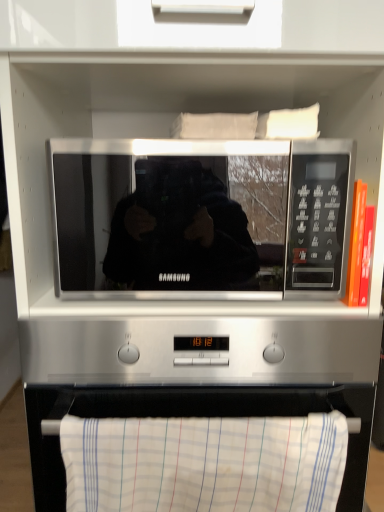
The image size is (384, 512). Describe the element at coordinates (201, 218) in the screenshot. I see `black glossy microwave at center` at that location.

Where is `black glossy microwave at center`? Image resolution: width=384 pixels, height=512 pixels. black glossy microwave at center is located at coordinates (201, 218).

This screenshot has height=512, width=384. Identify the location of white striped towel at lower center. (204, 463).

Image resolution: width=384 pixels, height=512 pixels. Describe the element at coordinates (204, 463) in the screenshot. I see `white striped towel at lower center` at that location.

What is the approximate height of white striped towel at lower center?

Result: It is 7.68 inches.

At what (x,y) coordinates should I click in order to perform the action: click on black glossy microwave at center. Please return your answer as a coordinate pair (x, y). Image resolution: width=384 pixels, height=512 pixels. Looking at the image, I should click on (201, 218).

Visually, is black glossy microwave at center positioned to the left or to the right of white striped towel at lower center?

black glossy microwave at center is positioned on white striped towel at lower center's left side.

Which is behind, black glossy microwave at center or white striped towel at lower center?

black glossy microwave at center is further away from the camera.

Does point (90, 262) come farther from viewer compared to point (227, 426)?

Yes, it is.

From the image's perspective, is black glossy microwave at center beneath white striped towel at lower center?

No.

Consider the image. From a real-world perspective, is black glossy microwave at center positioned above or below white striped towel at lower center?

In terms of real-world spatial position, black glossy microwave at center is above white striped towel at lower center.

Between black glossy microwave at center and white striped towel at lower center, which one has smaller width?

white striped towel at lower center.

In terms of height, does black glossy microwave at center look taller or shorter compared to white striped towel at lower center?

Clearly, black glossy microwave at center is taller compared to white striped towel at lower center.

Who is smaller, black glossy microwave at center or white striped towel at lower center?

Smaller between the two is white striped towel at lower center.

Is black glossy microwave at center inside or outside of white striped towel at lower center?

The correct answer is: outside.

Are black glossy microwave at center and white striped towel at lower center located far from each other?

No, there isn't a large distance between black glossy microwave at center and white striped towel at lower center.

Is black glossy microwave at center positioned with its back to white striped towel at lower center?

No.

What's the angular difference between black glossy microwave at center and white striped towel at lower center's facing directions?

The angle between the facing direction of black glossy microwave at center and the facing direction of white striped towel at lower center is 0.66 degrees.

Locate an element on the screen. This screenshot has height=512, width=384. cloth that appears in front of the black glossy microwave at center is located at coordinates (204, 463).

Would you say white striped towel at lower center is to the left or to the right of black glossy microwave at center in the picture?

white striped towel at lower center is to the right of black glossy microwave at center.

Which object is further away from the camera, white striped towel at lower center or black glossy microwave at center?

black glossy microwave at center is behind.

Looking at this image, which is closer, (x=125, y=436) or (x=227, y=295)?

The point (x=125, y=436) is closer.

From the image's perspective, is white striped towel at lower center on black glossy microwave at center?

Actually, white striped towel at lower center appears below black glossy microwave at center in the image.

From a real-world perspective, which object rests below the other?

From a 3D spatial view, white striped towel at lower center is below.

Which object is thinner, white striped towel at lower center or black glossy microwave at center?

Thinner between the two is white striped towel at lower center.

Which of these two, white striped towel at lower center or black glossy microwave at center, stands shorter?

With less height is white striped towel at lower center.

Looking at the image, does white striped towel at lower center seem bigger or smaller compared to black glossy microwave at center?

In the image, white striped towel at lower center appears to be smaller than black glossy microwave at center.

Is black glossy microwave at center a part of white striped towel at lower center?

No.

Is white striped towel at lower center in contact with black glossy microwave at center?

No, white striped towel at lower center is not making contact with black glossy microwave at center.

Is white striped towel at lower center positioned with its back to black glossy microwave at center?

No, white striped towel at lower center is not facing away from black glossy microwave at center.

What's the angular difference between white striped towel at lower center and black glossy microwave at center's facing directions?

0.66 degrees.

Locate an element on the screen. cloth that is on the right side of black glossy microwave at center is located at coordinates (204, 463).

In the image, there is a black glossy microwave at center. Where is `cloth below it (from the image's perspective)`? This screenshot has height=512, width=384. cloth below it (from the image's perspective) is located at coordinates (204, 463).

In order to click on cloth that is under the black glossy microwave at center (from a real-world perspective) in this screenshot , I will do `click(204, 463)`.